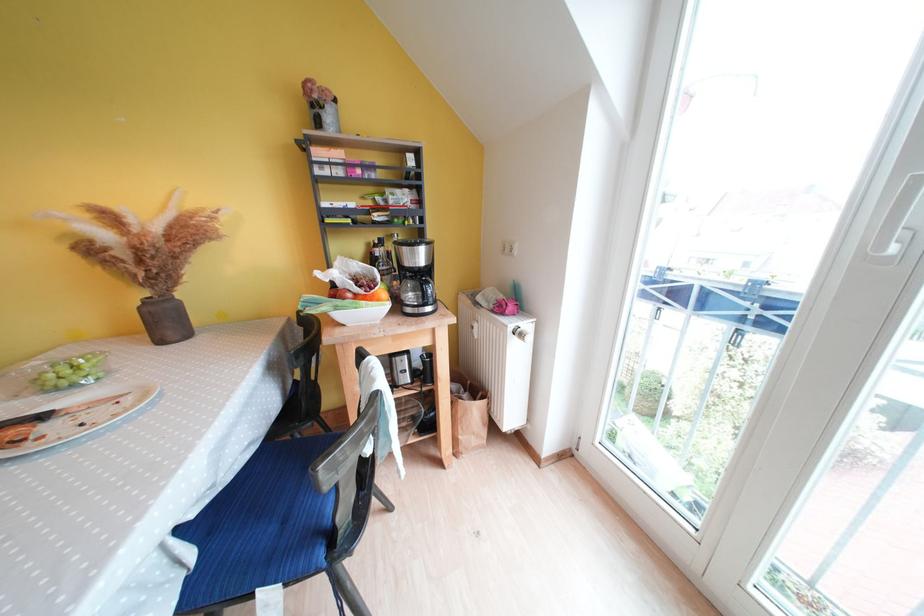
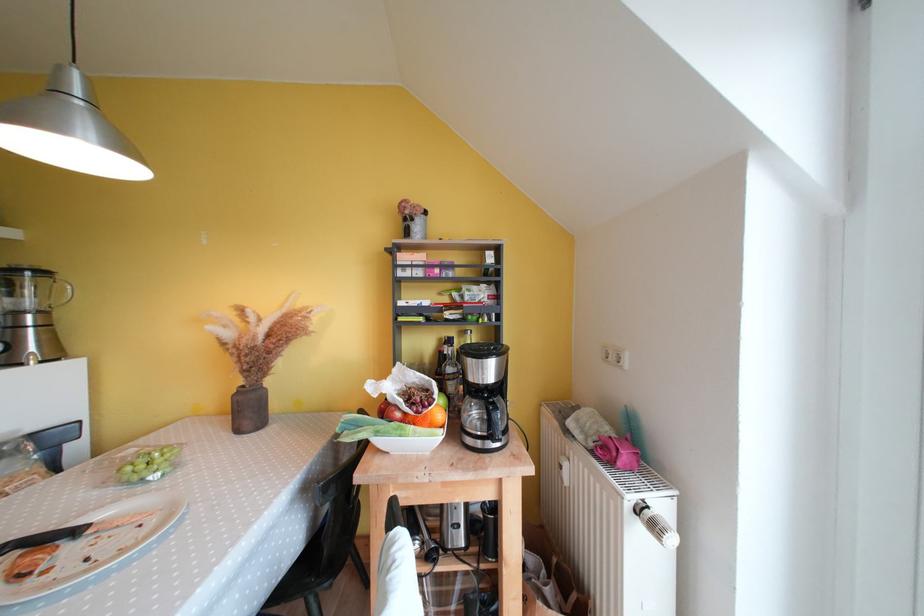
Find the pixel in the second image that matches [497,314] in the first image.

(599, 456)